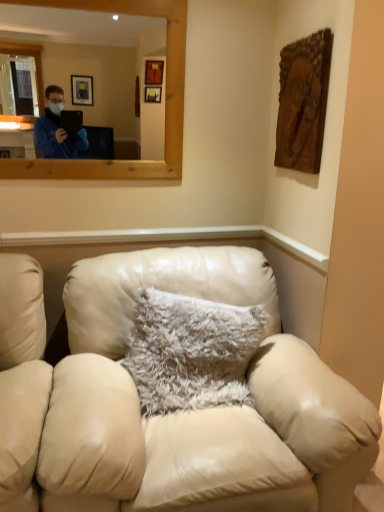
What is the approximate width of fuzzy white pillow at center?

10.96 inches.

This screenshot has height=512, width=384. What do you see at coordinates (97, 63) in the screenshot? I see `wooden mirror at upper center` at bounding box center [97, 63].

The width and height of the screenshot is (384, 512). What are the coordinates of `leather couch at center` in the screenshot? It's located at (173, 430).

Between fuzzy white pillow at center and wooden mirror at upper center, which one has smaller size?

wooden mirror at upper center.

From the image's perspective, is fuzzy white pillow at center positioned above or below wooden mirror at upper center?

Based on their image positions, fuzzy white pillow at center is located beneath wooden mirror at upper center.

Can you tell me how much fuzzy white pillow at center and wooden mirror at upper center differ in facing direction?

10.6 degrees separate the facing orientations of fuzzy white pillow at center and wooden mirror at upper center.

Is wooden mirror at upper center in front of fuzzy white pillow at center?

No, wooden mirror at upper center is further to the viewer.

Choose the correct answer: Is wooden mirror at upper center inside fuzzy white pillow at center or outside it?

wooden mirror at upper center is located beyond the bounds of fuzzy white pillow at center.

Consider the image. Between wooden mirror at upper center and fuzzy white pillow at center, which one has smaller width?

With smaller width is wooden mirror at upper center.

From a real-world perspective, is fuzzy white pillow at center under leather couch at center?

Actually, fuzzy white pillow at center is physically above leather couch at center in the real world.

How different are the orientations of fuzzy white pillow at center and leather couch at center in degrees?

They differ by 10.6 degrees in their facing directions.

Is fuzzy white pillow at center oriented away from leather couch at center?

Yes, fuzzy white pillow at center is facing away from leather couch at center.

Looking at this image, which is correct: leather couch at center is inside wooden mirror at upper center, or outside of it?

leather couch at center is spatially situated outside wooden mirror at upper center.

Can you confirm if leather couch at center is shorter than wooden mirror at upper center?

No.

Which object is more forward, leather couch at center or wooden mirror at upper center?

leather couch at center is in front.

Is point (12, 276) more distant than point (54, 64)?

No, it is not.

Looking at this image, between leather couch at center and fuzzy white pillow at center, which one has larger width?

leather couch at center is wider.

Does point (273, 482) appear closer or farther from the camera than point (215, 329)?

Clearly, point (273, 482) is closer to the camera than point (215, 329).

Between leather couch at center and fuzzy white pillow at center, which one has larger size?

Bigger between the two is leather couch at center.

Is wooden mirror at upper center bigger or smaller than leather couch at center?

In the image, wooden mirror at upper center appears to be smaller than leather couch at center.

Looking at their sizes, would you say wooden mirror at upper center is wider or thinner than leather couch at center?

Clearly, wooden mirror at upper center has less width compared to leather couch at center.

Measure the distance from wooden mirror at upper center to leather couch at center.

4.54 meters.

Which object is positioned more to the right, wooden mirror at upper center or leather couch at center?

leather couch at center is more to the right.

Where is `mirror on the left of the fuzzy white pillow at center`? The width and height of the screenshot is (384, 512). mirror on the left of the fuzzy white pillow at center is located at coordinates (97, 63).

This screenshot has width=384, height=512. In order to click on mirror that is above the fuzzy white pillow at center (from the image's perspective) in this screenshot , I will do `click(97, 63)`.

Estimate the real-world distances between objects in this image. Which object is closer to wooden mirror at upper center, fuzzy white pillow at center or leather couch at center?

The object closer to wooden mirror at upper center is fuzzy white pillow at center.

Looking at the image, which one is located further to leather couch at center, wooden mirror at upper center or fuzzy white pillow at center?

wooden mirror at upper center.

Considering their positions, is leather couch at center positioned closer to wooden mirror at upper center than fuzzy white pillow at center?

fuzzy white pillow at center is closer to wooden mirror at upper center.

Considering their positions, is wooden mirror at upper center positioned further to fuzzy white pillow at center than leather couch at center?

wooden mirror at upper center is positioned further to the anchor fuzzy white pillow at center.

Estimate the real-world distances between objects in this image. Which object is further from fuzzy white pillow at center, leather couch at center or wooden mirror at upper center?

wooden mirror at upper center.

Considering their positions, is fuzzy white pillow at center positioned further to leather couch at center than wooden mirror at upper center?

The object further to leather couch at center is wooden mirror at upper center.

Where is `pillow between wooden mirror at upper center and leather couch at center from top to bottom`? The width and height of the screenshot is (384, 512). pillow between wooden mirror at upper center and leather couch at center from top to bottom is located at coordinates (191, 351).